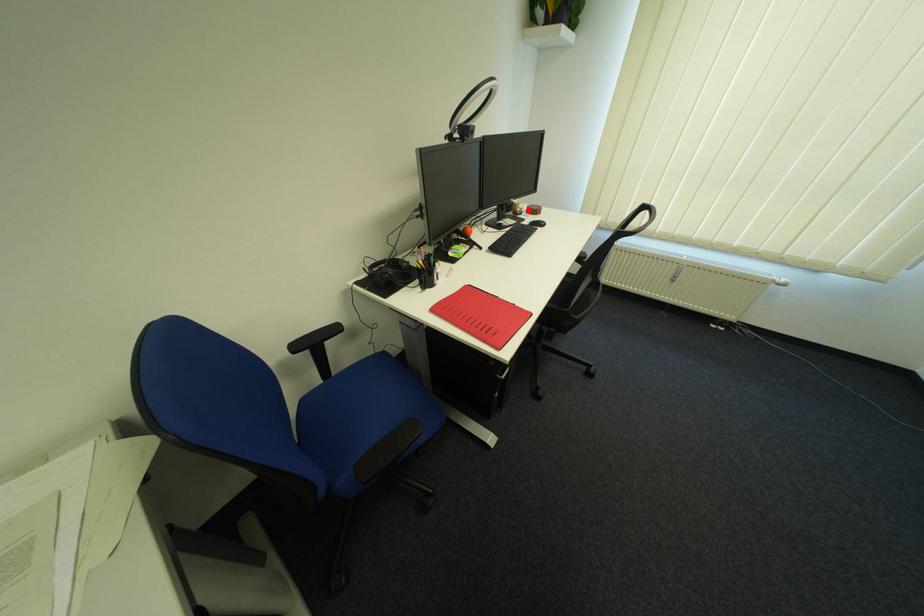
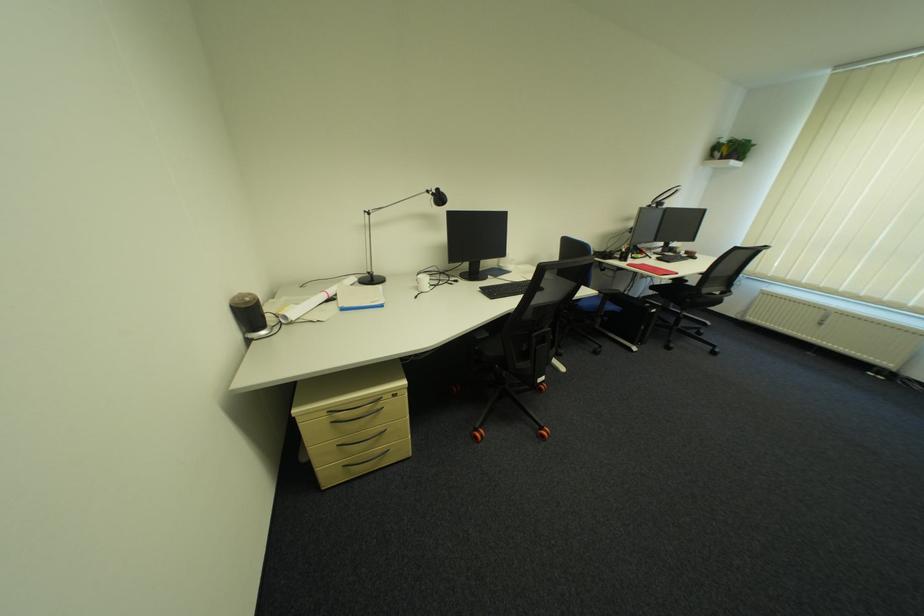
In the second image, find the point that corresponds to the highlighted location in the first image.

(687, 252)